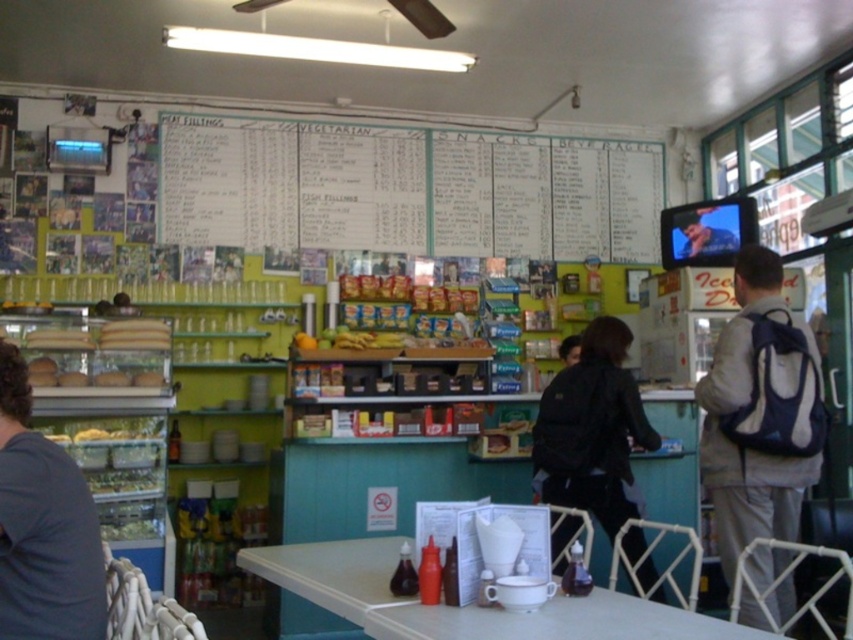
Between white paperboard at upper center and black backpack at center, which one has more height?

Standing taller between the two is black backpack at center.

Between white paperboard at upper center and black backpack at center, which one has less height?

With less height is white paperboard at upper center.

Locate an element on the screen. white paperboard at upper center is located at coordinates coord(407,189).

Find the location of a particular element. Image resolution: width=853 pixels, height=640 pixels. white paperboard at upper center is located at coordinates (407, 189).

Which is above, white paperboard at upper center or gray fabric backpack at right?

white paperboard at upper center is higher up.

Consider the image. Which is below, white paperboard at upper center or gray fabric backpack at right?

gray fabric backpack at right is lower down.

Is point (567, 205) positioned in front of point (738, 328)?

No, it is behind (738, 328).

You are a GUI agent. You are given a task and a screenshot of the screen. Output one action in this format:
    pyautogui.click(x=<x>, y=<y>)
    Task: Click on the white paperboard at upper center
    The image size is (853, 640).
    Given the screenshot: What is the action you would take?
    pyautogui.click(x=407, y=189)

Can you confirm if gray fabric backpack at right is positioned to the left of white plastic table at center?

Incorrect, gray fabric backpack at right is not on the left side of white plastic table at center.

Measure the distance between gray fabric backpack at right and camera.

A distance of 9.46 feet exists between gray fabric backpack at right and camera.

This screenshot has width=853, height=640. I want to click on gray fabric backpack at right, so click(743, 406).